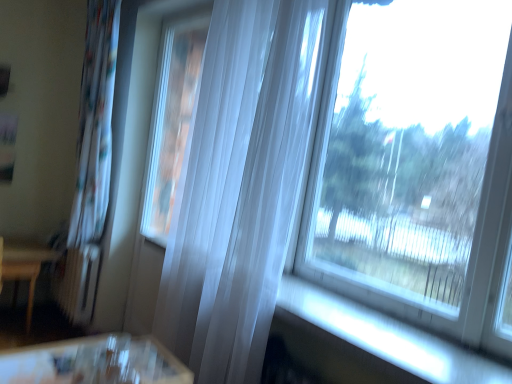
Question: From a real-world perspective, is translucent white curtain at center, the 1th curtain positioned from the front, physically located above or below transparent glass window at upper right?

Choices:
 (A) below
 (B) above

Answer: (A)

Question: Based on their sizes in the image, would you say translucent white curtain at center, the first curtain viewed from the right, is bigger or smaller than transparent glass window at upper right?

Choices:
 (A) big
 (B) small

Answer: (A)

Question: Which is nearer to the wooden table at left?

Choices:
 (A) transparent glass window at upper right
 (B) translucent white curtain at center, the 1th curtain positioned from the front
 (C) white sheer curtain at left, the 2th curtain positioned from the right

Answer: (C)

Question: Which object is positioned farthest from the white sheer curtain at left, the first curtain in the back-to-front sequence?

Choices:
 (A) translucent white curtain at center, acting as the 2th curtain starting from the left
 (B) wooden table at left
 (C) transparent glass window at upper right

Answer: (C)